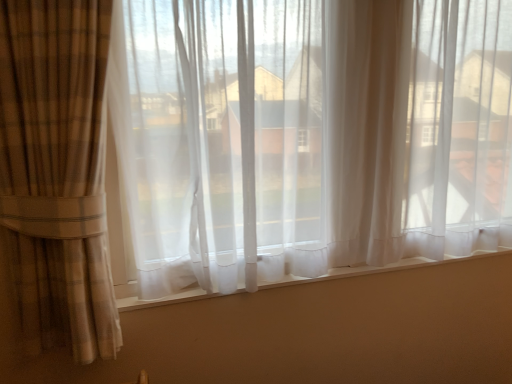
Question: Looking at the image, does white sheer curtain at center seem bigger or smaller compared to translucent white curtain at center?

Choices:
 (A) small
 (B) big

Answer: (A)

Question: From a real-world perspective, is white sheer curtain at center above or below translucent white curtain at center?

Choices:
 (A) below
 (B) above

Answer: (A)

Question: In the image, is white sheer curtain at center positioned in front of or behind translucent white curtain at center?

Choices:
 (A) front
 (B) behind

Answer: (B)

Question: From a real-world perspective, is translucent white curtain at center above or below white sheer curtain at center?

Choices:
 (A) above
 (B) below

Answer: (A)

Question: Is translucent white curtain at center in front of or behind white sheer curtain at center in the image?

Choices:
 (A) front
 (B) behind

Answer: (A)

Question: From their relative heights in the image, would you say translucent white curtain at center is taller or shorter than white sheer curtain at center?

Choices:
 (A) short
 (B) tall

Answer: (B)

Question: Considering the relative positions of translucent white curtain at center and white sheer curtain at center in the image provided, is translucent white curtain at center to the left or to the right of white sheer curtain at center?

Choices:
 (A) right
 (B) left

Answer: (A)